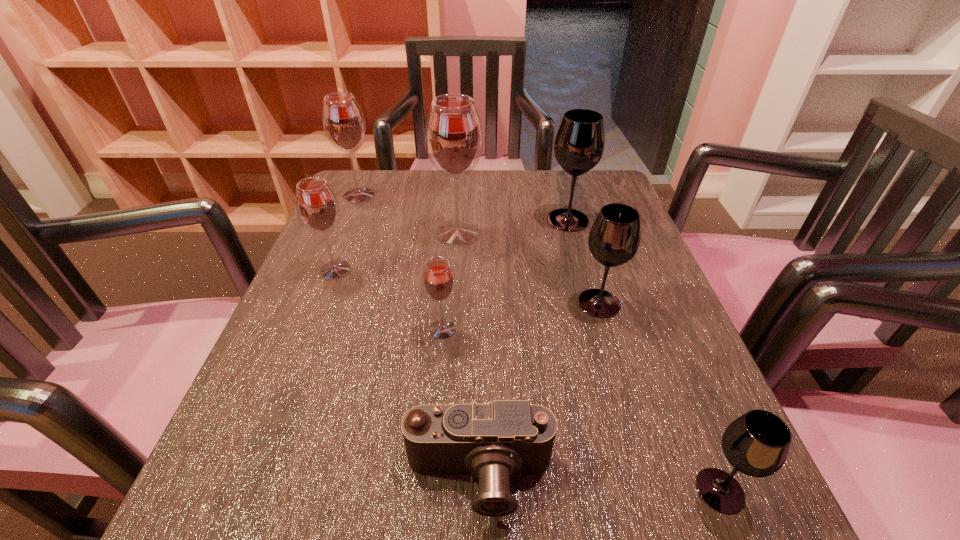
The width and height of the screenshot is (960, 540). I want to click on camera that is at the near edge, so coord(507,438).

In order to click on object that is at the far left corner in this screenshot , I will do `click(343, 121)`.

You are a GUI agent. You are given a task and a screenshot of the screen. Output one action in this format:
    pyautogui.click(x=<x>, y=<y>)
    Task: Click on the object at the far right corner
    
    Given the screenshot: What is the action you would take?
    click(579, 144)

Where is `object at the near right corner`? object at the near right corner is located at coordinates (757, 443).

At what (x,y) coordinates should I click in order to perform the action: click on free point at the far edge. Please return your answer as a coordinate pair (x, y). Image resolution: width=960 pixels, height=540 pixels. Looking at the image, I should click on point(425,172).

The height and width of the screenshot is (540, 960). Identify the location of free region at the near edge of the desktop. (344, 489).

Image resolution: width=960 pixels, height=540 pixels. What are the coordinates of `free space at the left edge` in the screenshot? It's located at (368, 258).

Identify the location of blank space at the right edge of the desktop. The image size is (960, 540). (713, 445).

The height and width of the screenshot is (540, 960). I want to click on vacant space at the far left corner of the desktop, so click(x=386, y=193).

In the image, there is a desktop. Where is `blank space at the far right corner`? The image size is (960, 540). blank space at the far right corner is located at coordinates (561, 183).